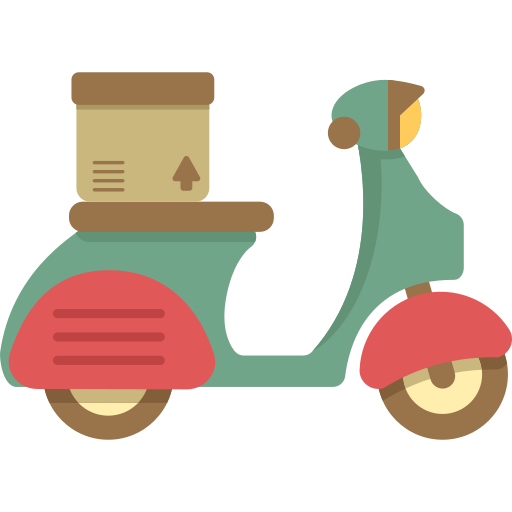
In order to click on box lid in this screenshot , I will do `click(134, 92)`.